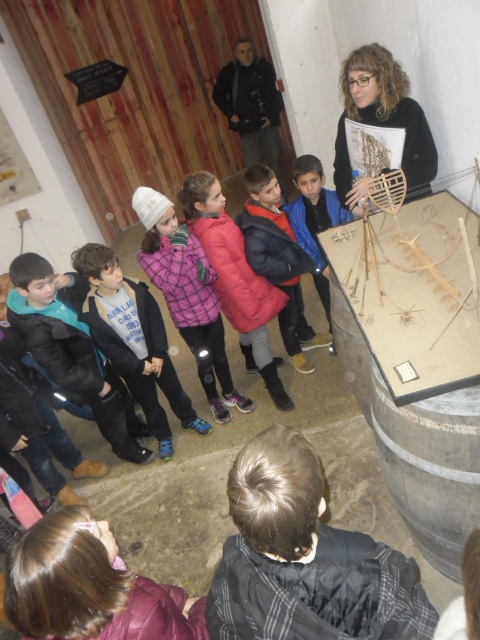
Question: Which object is farther from the camera taking this photo?

Choices:
 (A) light gray fleece jacket at lower left
 (B) red fleece jacket at center

Answer: (B)

Question: Does black fuzzy jacket at lower center have a lesser width compared to blue fleece jacket at center?

Choices:
 (A) yes
 (B) no

Answer: (B)

Question: Which object is the farthest from the brown hair at lower left?

Choices:
 (A) light gray fleece jacket at lower left
 (B) black fuzzy jacket at lower center
 (C) red fleece jacket at center

Answer: (C)

Question: Does plaid fleece jacket at center have a lesser width compared to wooden ship at upper right?

Choices:
 (A) no
 (B) yes

Answer: (A)

Question: Which of the following is the closest to the observer?

Choices:
 (A) blue fleece jacket at center
 (B) pink puffy jacket at center
 (C) wooden ship at upper right

Answer: (C)

Question: From the image, what is the correct spatial relationship of black fuzzy jacket at lower center in relation to brown hair at lower left?

Choices:
 (A) right
 (B) left

Answer: (A)